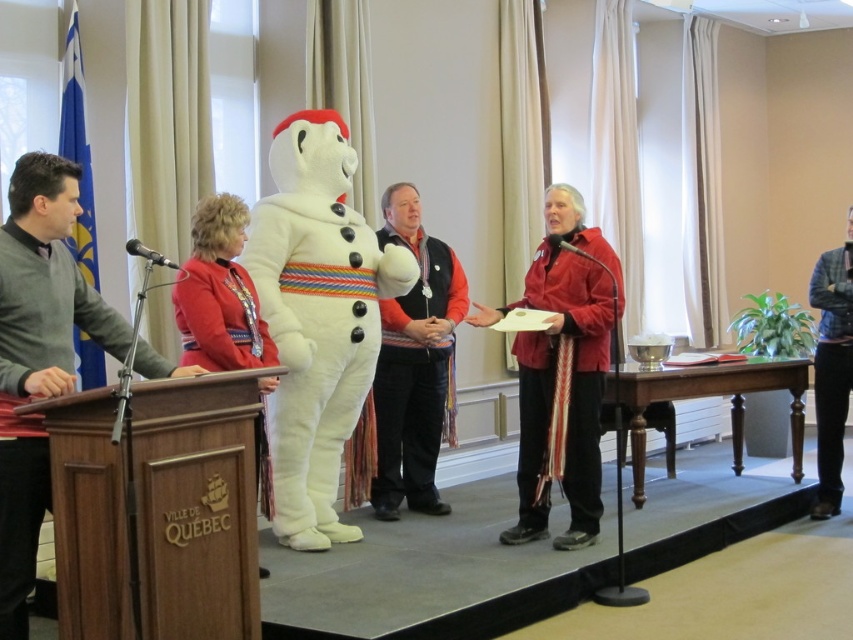
You are attending a formal event in a conference hall. You see a brown wood podium at left and a red fabric jacket at center. Which object is positioned lower in the image?

The brown wood podium at left is positioned lower than the red fabric jacket at center in the image.

You are organizing a holiday event and need to place a 2 meter wide banner between the white plush snowman at center and the wooden podium at center. Can you fit the banner between them?

The distance between the white plush snowman at center and the wooden podium at center is 2.01 meters, so yes, a 2 meter wide banner can fit between them since it is slightly narrower than the available space.